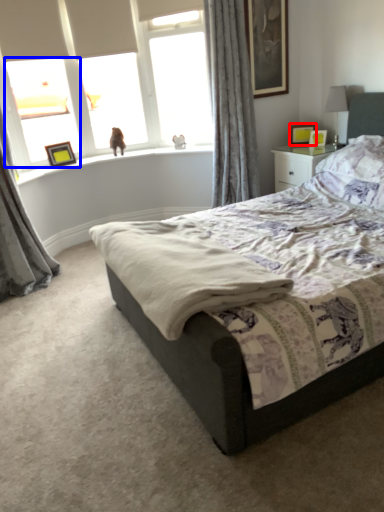
Question: Which object appears farthest to the camera in this image, picture frame (highlighted by a red box) or window (highlighted by a blue box)?

Choices:
 (A) picture frame
 (B) window

Answer: (A)